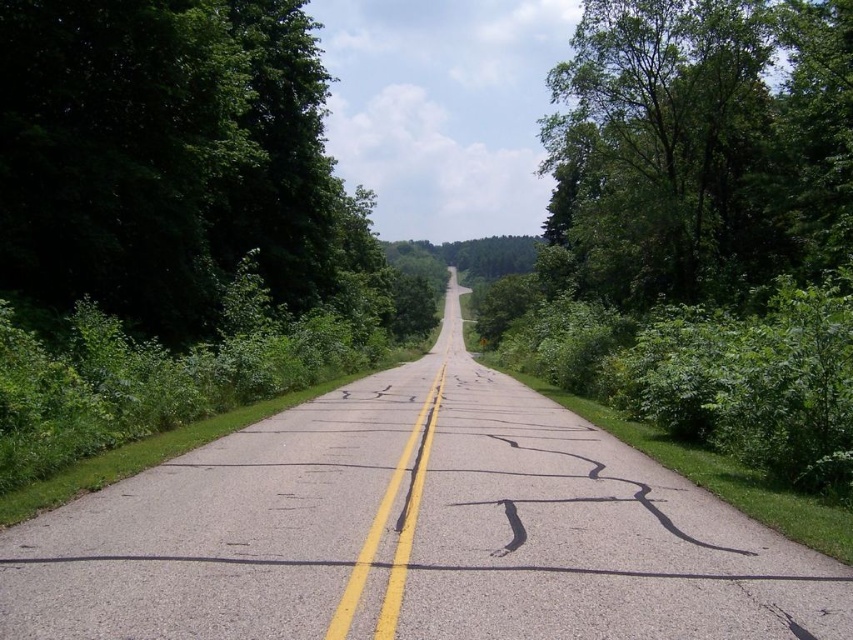
Who is shorter, green leafy tree at left or green leafy tree at upper right?

With less height is green leafy tree at left.

Is point (323, 225) behind point (676, 8)?

Yes, it is.

What are the coordinates of `green leafy tree at left` in the screenshot? It's located at (169, 160).